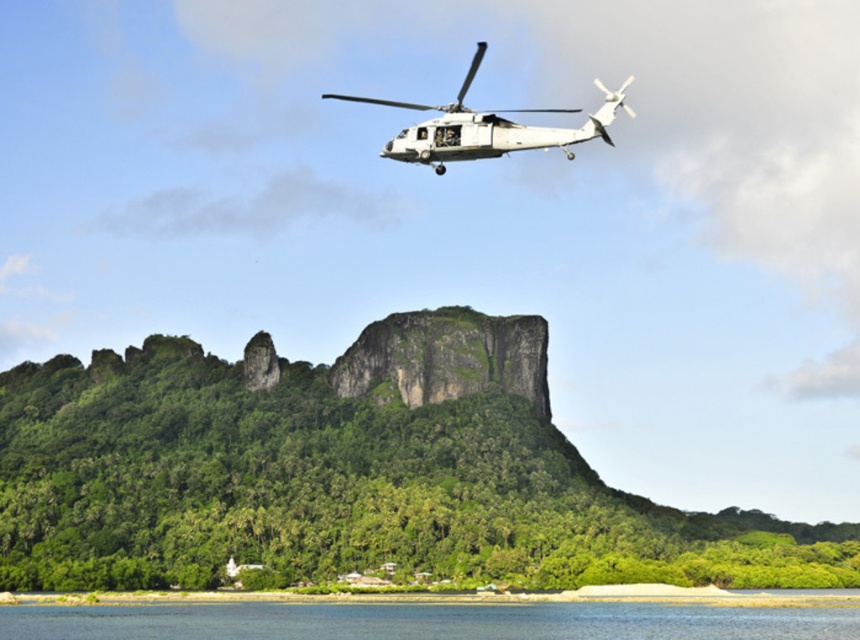
Between green leafy mountain at center and blue water at lower center, which one is positioned lower?

Positioned lower is blue water at lower center.

Does green leafy mountain at center have a lesser width compared to blue water at lower center?

No.

Image resolution: width=860 pixels, height=640 pixels. I want to click on green leafy mountain at center, so click(347, 472).

Does green leafy mountain at center have a smaller size compared to white matte helicopter at upper center?

Yes, green leafy mountain at center is smaller than white matte helicopter at upper center.

Does green leafy mountain at center have a lesser width compared to white matte helicopter at upper center?

No, green leafy mountain at center is not thinner than white matte helicopter at upper center.

Who is more forward, (64, 404) or (578, 138)?

Point (578, 138) is more forward.

At what (x,y) coordinates should I click in order to perform the action: click on green leafy mountain at center. Please return your answer as a coordinate pair (x, y). Looking at the image, I should click on (347, 472).

Between blue water at lower center and white matte helicopter at upper center, which one is positioned lower?

blue water at lower center is lower down.

Which is more to the right, blue water at lower center or white matte helicopter at upper center?

white matte helicopter at upper center

Which is behind, point (769, 609) or point (481, 54)?

Positioned behind is point (481, 54).

Where is `blue water at lower center`? The height and width of the screenshot is (640, 860). blue water at lower center is located at coordinates (427, 620).